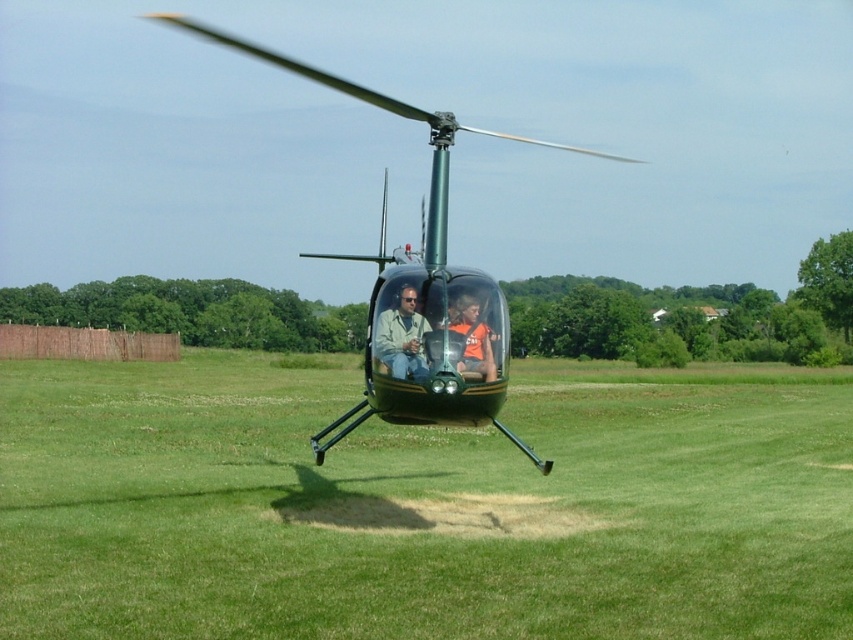
Question: Observing the image, what is the correct spatial positioning of green glossy helicopter at center in reference to orange jersey at center?

Choices:
 (A) left
 (B) right

Answer: (A)

Question: Is green glossy helicopter at center wider than orange jersey at center?

Choices:
 (A) yes
 (B) no

Answer: (A)

Question: Among these points, which one is farthest from the camera?

Choices:
 (A) (117, 461)
 (B) (379, 324)
 (C) (160, 13)
 (D) (466, 348)

Answer: (C)

Question: Estimate the real-world distances between objects in this image. Which object is farther from the orange jersey at center?

Choices:
 (A) green grass at center
 (B) matte green helicopter at center

Answer: (A)

Question: Which point appears closest to the camera in this image?

Choices:
 (A) (514, 634)
 (B) (383, 333)
 (C) (469, 307)
 (D) (537, 458)

Answer: (A)

Question: Can you confirm if matte green helicopter at center is positioned above orange jersey at center?

Choices:
 (A) no
 (B) yes

Answer: (A)